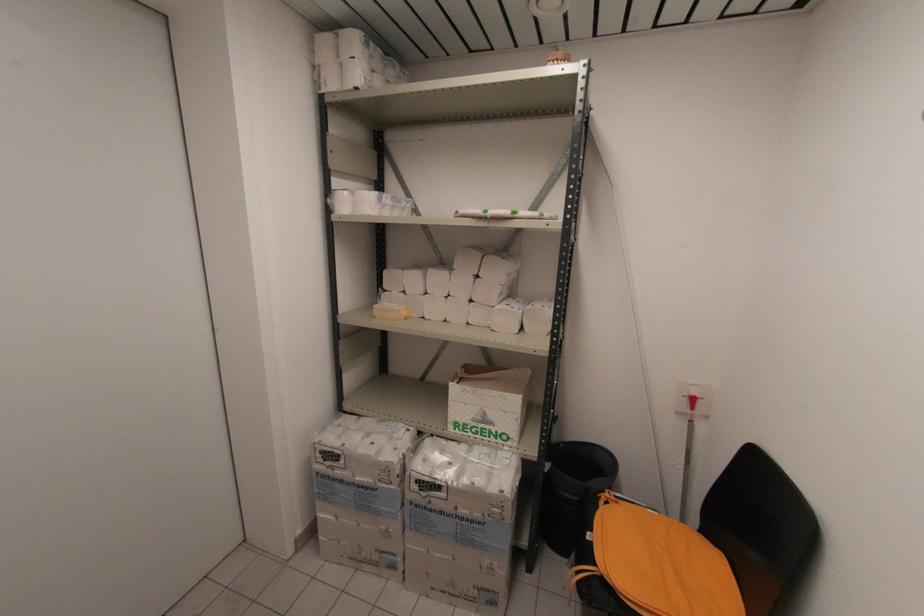
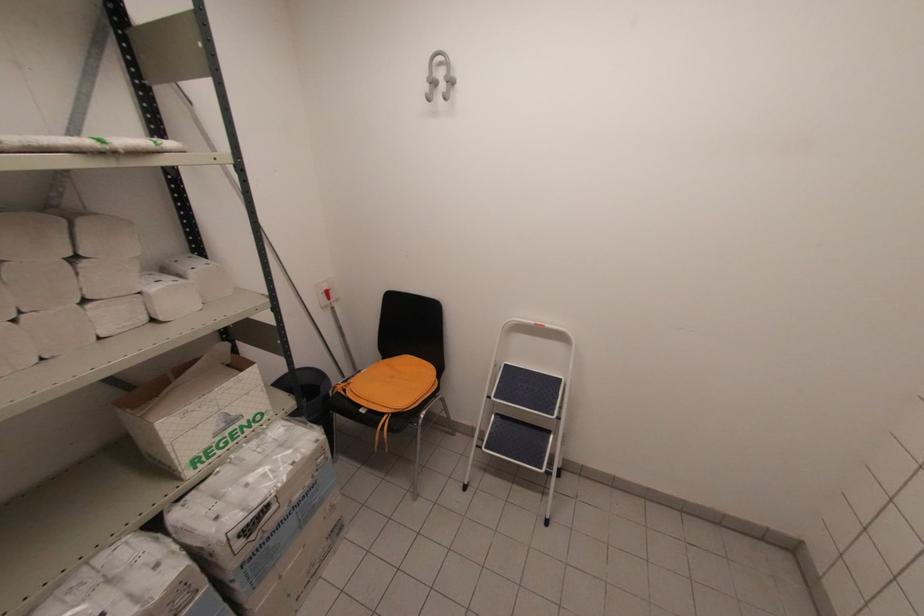
Where in the second image is the point corresponding to point 432,512 from the first image?

(271, 539)